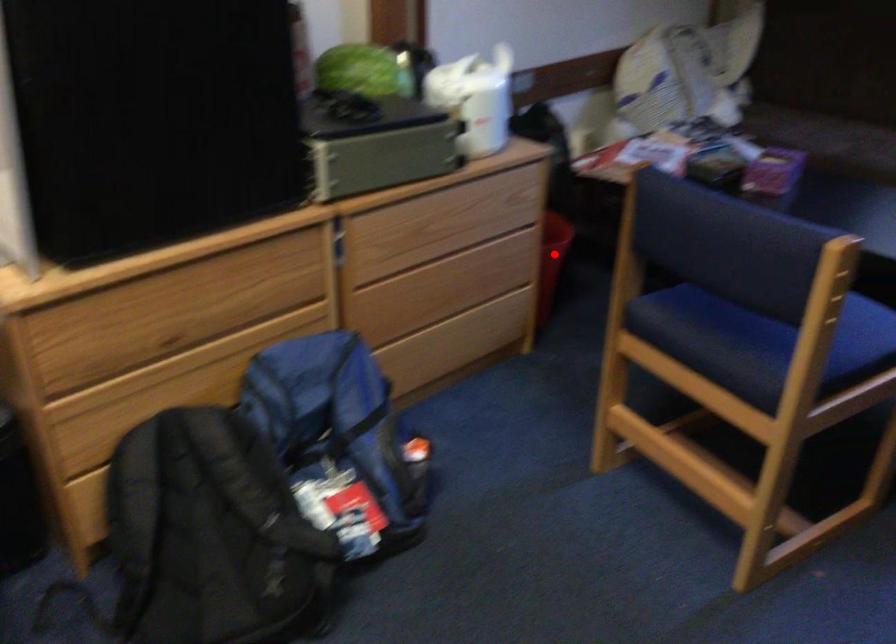
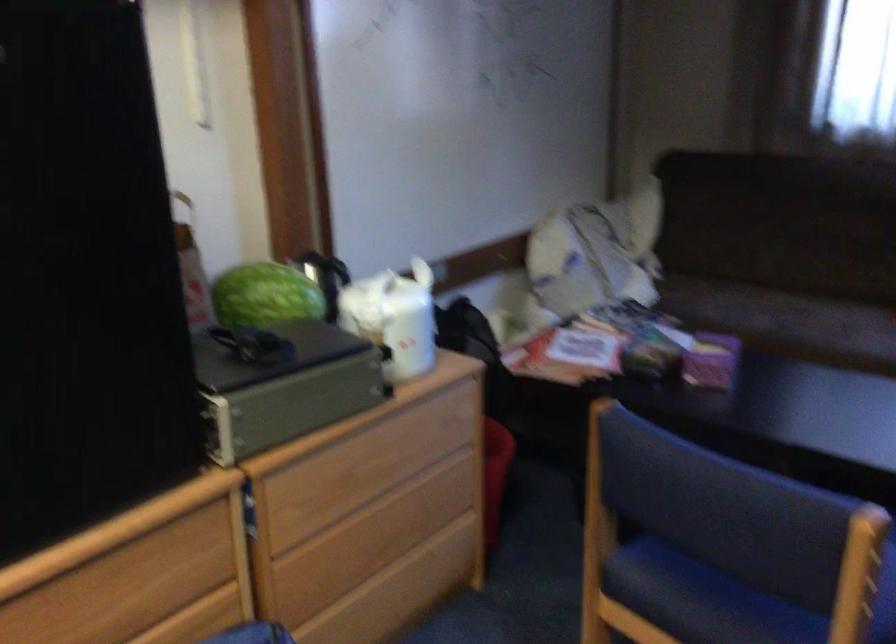
Question: I am providing you with two images of the same scene from different viewpoints. Image1 has a red point marked. In image2, the corresponding 3D location appears at what relative position? Reply with the corresponding letter.

Choices:
 (A) Closer
 (B) Farther

Answer: (A)